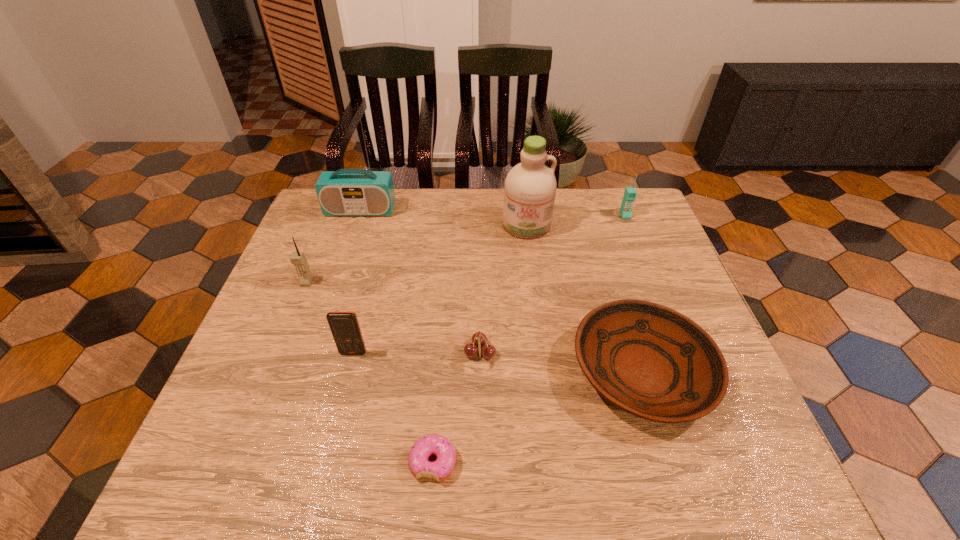
You are a GUI agent. You are given a task and a screenshot of the screen. Output one action in this format:
    pyautogui.click(x=<x>, y=<y>)
    Task: Click on the free space located on the front panel of the radio receiver
    
    Given the screenshot: What is the action you would take?
    click(347, 253)

This screenshot has width=960, height=540. I want to click on vacant position located 0.170m on the front label of the cleansing agent, so click(x=534, y=281).

This screenshot has height=540, width=960. In order to click on vacant area located 0.300m on the front of the second farthest cellular telephone, where the keypad is located in this screenshot , I will do `click(264, 387)`.

Where is `vacant space situated 0.180m on the keypad of the rightmost cellular telephone`? The image size is (960, 540). vacant space situated 0.180m on the keypad of the rightmost cellular telephone is located at coordinates (642, 258).

Identify the location of vacant space situated on the screen of the second cellular telephone from right to left. (327, 456).

This screenshot has height=540, width=960. Find the location of `free space located 0.320m on the leaves of the fifth object from left to right`. free space located 0.320m on the leaves of the fifth object from left to right is located at coordinates (637, 353).

At what (x,y) coordinates should I click in order to perform the action: click on free space located 0.210m on the back of the plate. Please return your answer as a coordinate pair (x, y). The image size is (960, 540). Looking at the image, I should click on (608, 260).

Find the location of a particular element. The width and height of the screenshot is (960, 540). vacant space situated 0.360m on the back of the doughnut is located at coordinates (445, 303).

This screenshot has width=960, height=540. Identify the location of radio receiver positioned at the far edge. (346, 192).

Find the location of `cleansing agent located in the far edge section of the desktop`. cleansing agent located in the far edge section of the desktop is located at coordinates pyautogui.click(x=530, y=187).